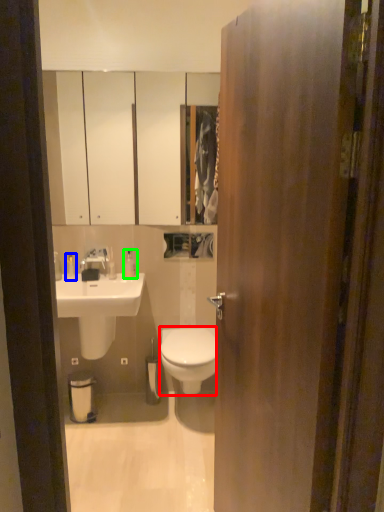
Question: Which object is positioned farthest from bidet (highlighted by a red box)? Select from toiletry (highlighted by a blue box) and toiletry (highlighted by a green box).

Choices:
 (A) toiletry
 (B) toiletry

Answer: (A)